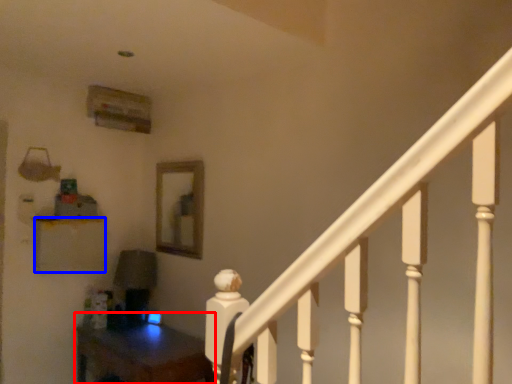
Question: Among these objects, which one is nearest to the camera, table (highlighted by a red box) or furniture (highlighted by a blue box)?

Choices:
 (A) table
 (B) furniture

Answer: (A)